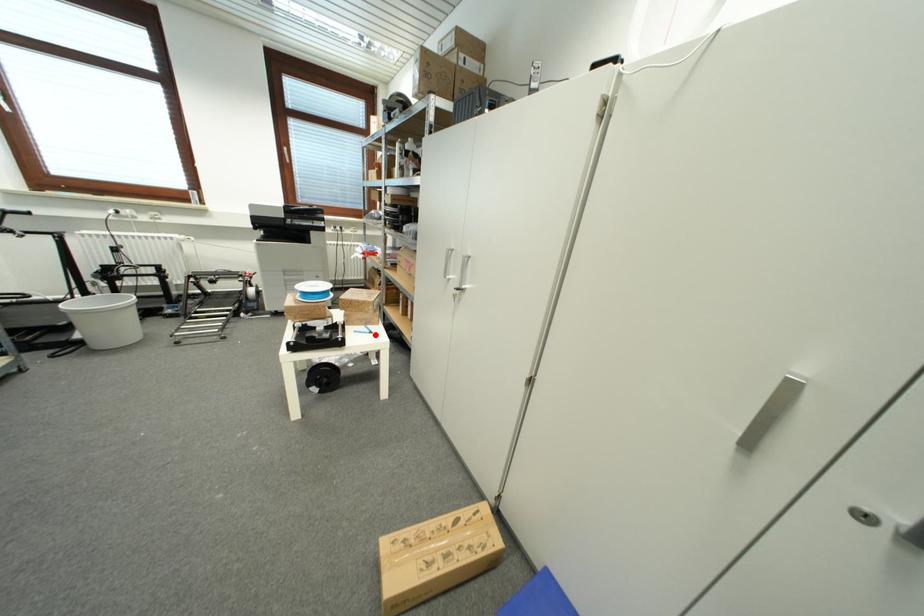
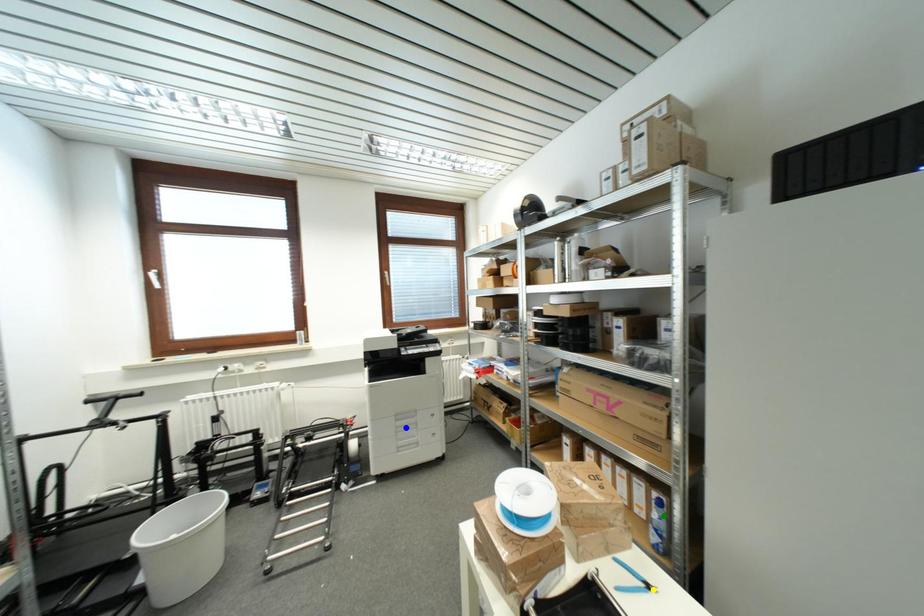
Question: I am providing you with two images of the same scene from different viewpoints. A red point is marked on the first image. You are given multiple points on the second image. Which point in image 2 represents the same 3d spot as the red point in image 1?

Choices:
 (A) green point
 (B) yellow point
 (C) blue point

Answer: (B)